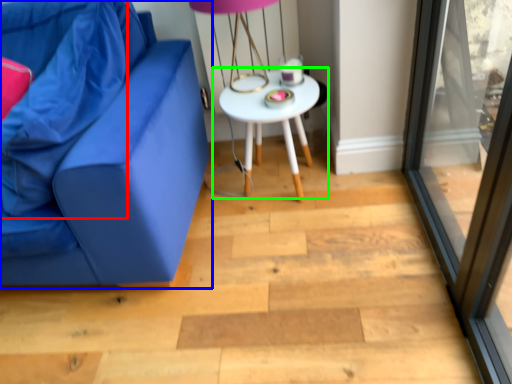
Question: Estimate the real-world distances between objects in this image. Which object is closer to pillow (highlighted by a red box), studio couch (highlighted by a blue box) or table (highlighted by a green box)?

Choices:
 (A) studio couch
 (B) table

Answer: (A)